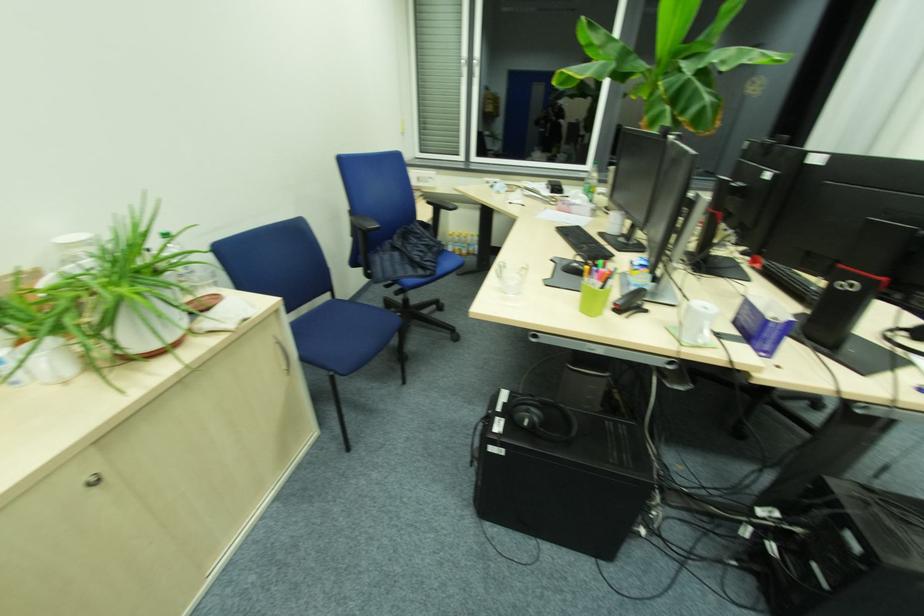
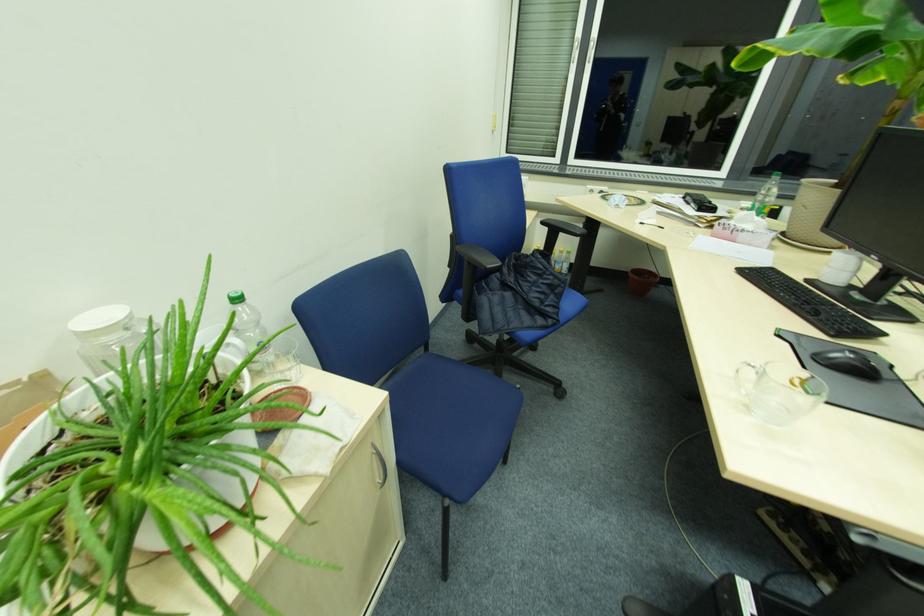
In a continuous first-person perspective shot, in which direction is the camera moving?

The movement direction of the cameraman is left, forward.